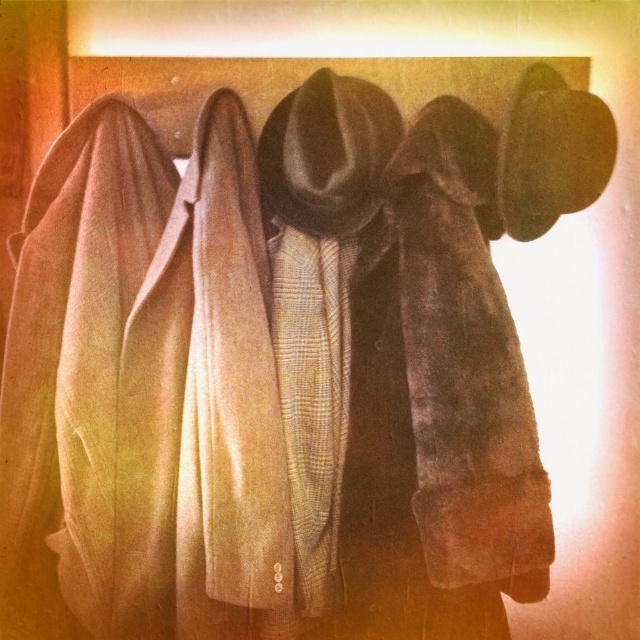
How distant is brown fur scarf at center from plaid wool scarf at center?

The distance of brown fur scarf at center from plaid wool scarf at center is 15.01 centimeters.

Where is `brown fur scarf at center`? This screenshot has width=640, height=640. brown fur scarf at center is located at coordinates (465, 364).

Does point (435, 410) come in front of point (296, 346)?

Yes, point (435, 410) is closer to viewer.

Locate an element on the screen. brown fur scarf at center is located at coordinates (465, 364).